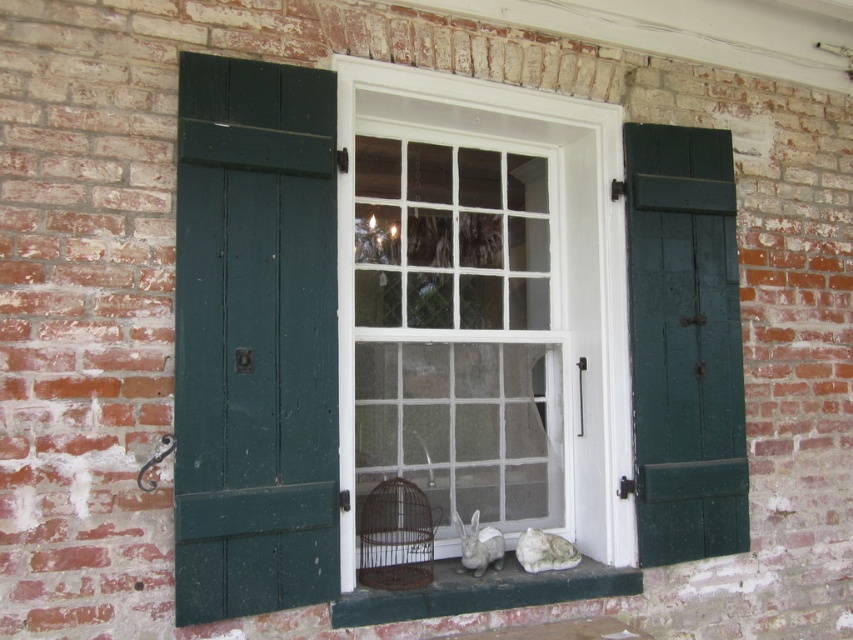
Looking at this image, you are an architect assessing the structural integrity of the building. You notice the white painted wood window frame at center and the green painted wood at right. Which of these two elements is taller?

The white painted wood window frame at center is taller than the green painted wood at right according to the description.

You are an interior designer planning to place a new decorative item on the windowsill. You have two options for placement spots based on the objects present. The first spot is near the green wood shutter at left, and the second is near the green painted wood at lower center. Which location offers more space for the item?

The green wood shutter at left is larger in size than the green painted wood at lower center, so placing the decorative item near the green wood shutter at left would provide more space.